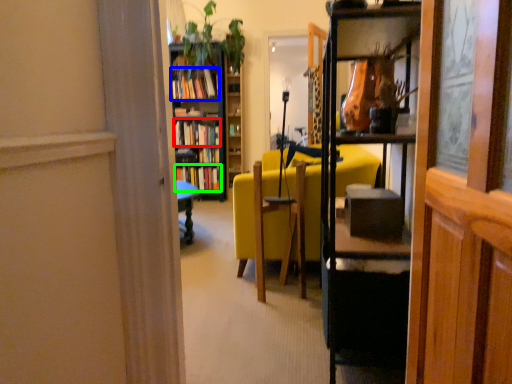
Question: Estimate the real-world distances between objects in this image. Which object is closer to book (highlighted by a red box), book (highlighted by a blue box) or book (highlighted by a green box)?

Choices:
 (A) book
 (B) book

Answer: (B)